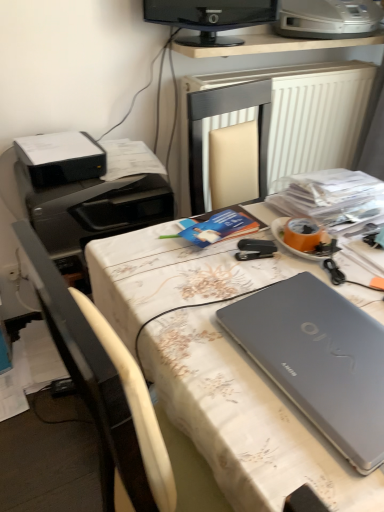
Question: From the image's perspective, is white fabric-covered desk at center positioned above or below black glossy monitor at upper center?

Choices:
 (A) below
 (B) above

Answer: (A)

Question: Looking at the image, does white fabric-covered desk at center seem bigger or smaller compared to black glossy monitor at upper center?

Choices:
 (A) big
 (B) small

Answer: (A)

Question: Based on their relative distances, which object is nearer to the black plastic printer at upper left, arranged as the second printer when viewed from the top?

Choices:
 (A) black glossy monitor at upper center
 (B) silver metallic printer at upper right, which appears as the 3th printer when ordered from the bottom
 (C) black plastic printer at left, the third printer when ordered from top to bottom
 (D) white textured radiator at upper center
 (E) white fabric-covered desk at center

Answer: (C)

Question: Estimate the real-world distances between objects in this image. Which object is closer to the white textured radiator at upper center?

Choices:
 (A) black plastic printer at left, the 1th printer ordered from the bottom
 (B) silver metallic printer at upper right, which is counted as the 1th printer, starting from the right
 (C) white fabric-covered desk at center
 (D) black plastic printer at upper left, arranged as the second printer when viewed from the top
 (E) black glossy monitor at upper center

Answer: (B)